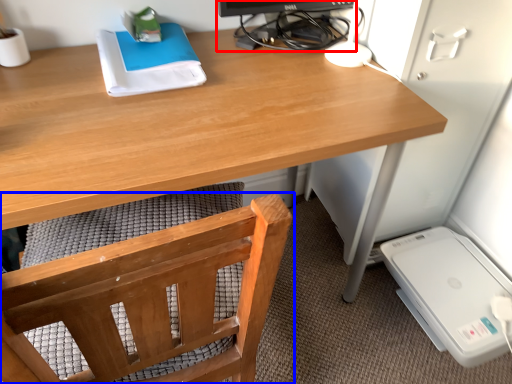
Question: Which object appears farthest to the camera in this image, desktop computer (highlighted by a red box) or chair (highlighted by a blue box)?

Choices:
 (A) desktop computer
 (B) chair

Answer: (A)